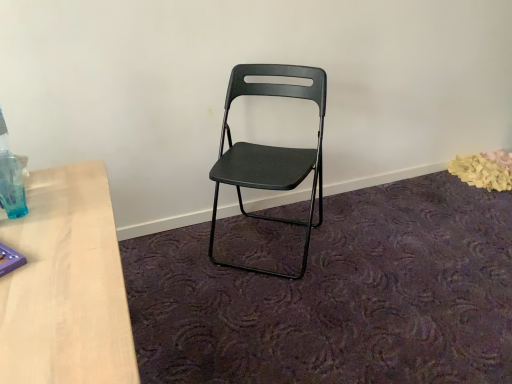
Question: From a real-world perspective, is translucent blue plastic bottle at left above or below matte black folding chair at center?

Choices:
 (A) above
 (B) below

Answer: (A)

Question: Considering the positions of translucent blue plastic bottle at left and matte black folding chair at center in the image, is translucent blue plastic bottle at left taller or shorter than matte black folding chair at center?

Choices:
 (A) tall
 (B) short

Answer: (B)

Question: Would you say translucent blue plastic bottle at left is to the left or to the right of matte black folding chair at center in the picture?

Choices:
 (A) left
 (B) right

Answer: (A)

Question: From the image's perspective, is matte black folding chair at center positioned above or below translucent blue plastic bottle at left?

Choices:
 (A) below
 (B) above

Answer: (B)

Question: Considering the positions of point (254, 215) and point (19, 190), is point (254, 215) closer or farther from the camera than point (19, 190)?

Choices:
 (A) closer
 (B) farther

Answer: (B)

Question: Is matte black folding chair at center inside or outside of translucent blue plastic bottle at left?

Choices:
 (A) outside
 (B) inside

Answer: (A)

Question: Looking at their shapes, would you say matte black folding chair at center is wider or thinner than translucent blue plastic bottle at left?

Choices:
 (A) wide
 (B) thin

Answer: (A)